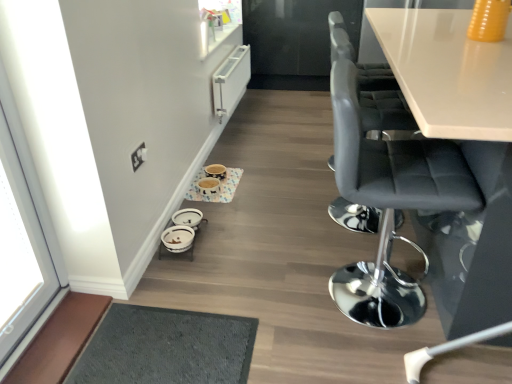
Locate an element on the screen. This screenshot has width=512, height=384. vacant space that's between black leather stool at right, placed as the first chair when sorted from front to back, and matte ceramic bowls at center, positioned as the 1th round table in top-to-bottom order is located at coordinates (279, 230).